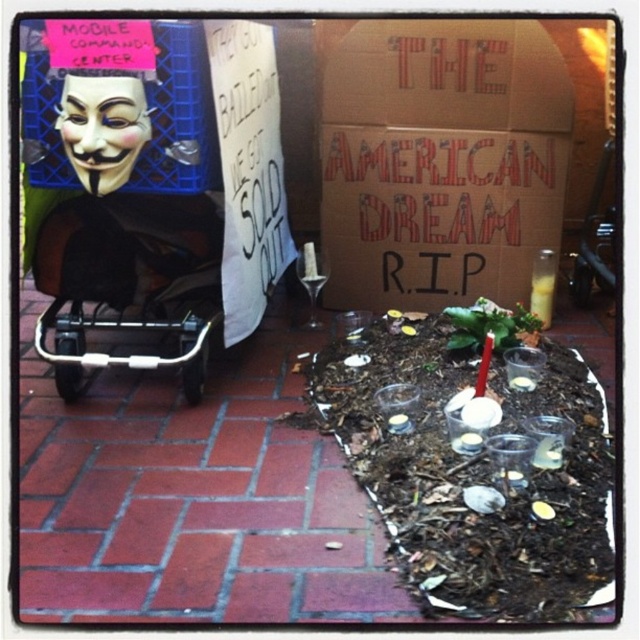
You are a photographer trying to capture the memorial setup. You want to ensure both the cardboard at center and the metallic silver baby carriage at left are clearly visible in your shot. Given their height difference, which object might require you to adjust your camera angle more significantly to include its full view?

The cardboard at center is much taller than the metallic silver baby carriage at left, so you would need to adjust your camera angle more significantly to include the full view of the cardboard at center.

You are a photographer standing at the back of the memorial setup. You want to take a photo that includes both the brown mulch at center and the metallic silver baby carriage at left. Which object should you adjust your camera angle to focus on first to ensure both are in frame?

Since the brown mulch at center is closer to the viewer than the metallic silver baby carriage at left, you should focus on the brown mulch at center first and then adjust the angle to include the metallic silver baby carriage at left in the background.